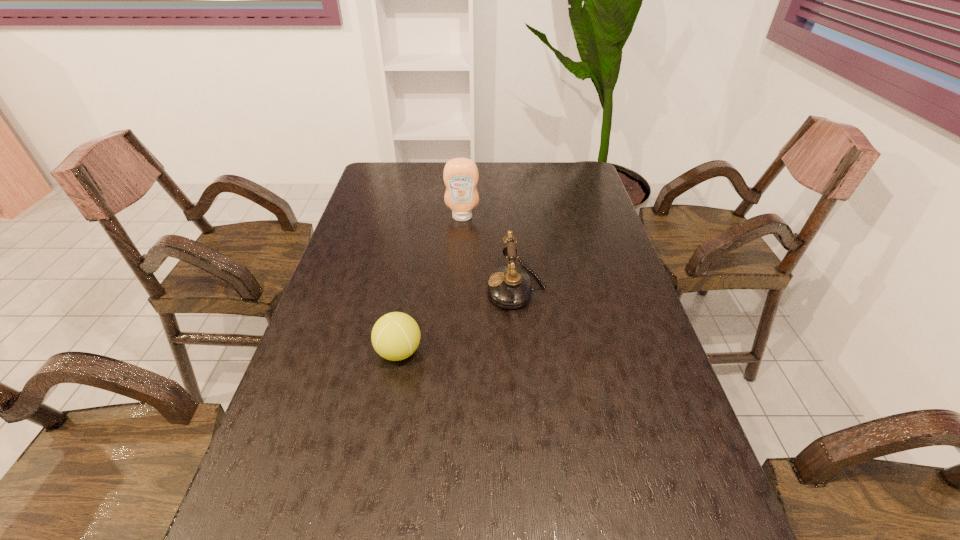
The height and width of the screenshot is (540, 960). Find the location of `vacant space situated 0.140m on the right of the shortest object`. vacant space situated 0.140m on the right of the shortest object is located at coordinates (480, 352).

What are the coordinates of `vacant space at the far edge of the desktop` in the screenshot? It's located at (434, 184).

The height and width of the screenshot is (540, 960). In the image, there is a desktop. Find the location of `vacant area at the left edge`. vacant area at the left edge is located at coordinates (279, 413).

This screenshot has width=960, height=540. In order to click on free location at the right edge of the desktop in this screenshot , I will do `click(683, 454)`.

In the image, there is a desktop. What are the coordinates of `free space at the far left corner` in the screenshot? It's located at (404, 179).

At what (x,y) coordinates should I click in order to perform the action: click on free space at the far right corner. Please return your answer as a coordinate pair (x, y). Looking at the image, I should click on (564, 165).

The width and height of the screenshot is (960, 540). Find the location of `empty space that is in between the second object from right to left and the tennis ball`. empty space that is in between the second object from right to left and the tennis ball is located at coordinates (431, 285).

The height and width of the screenshot is (540, 960). In order to click on vacant region between the second shortest object and the tallest object in this screenshot , I will do `click(490, 252)`.

Locate an element on the screen. free spot between the shortest object and the condiment is located at coordinates (431, 285).

I want to click on vacant region between the telephone and the leftmost object, so click(x=458, y=319).